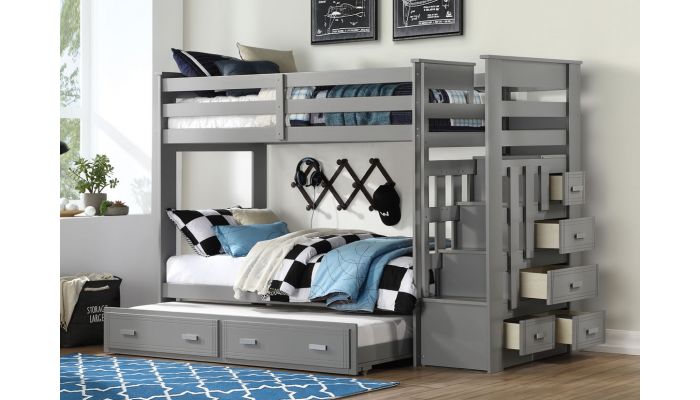
This screenshot has width=700, height=400. In order to click on pillow in this screenshot , I will do `click(209, 229)`.